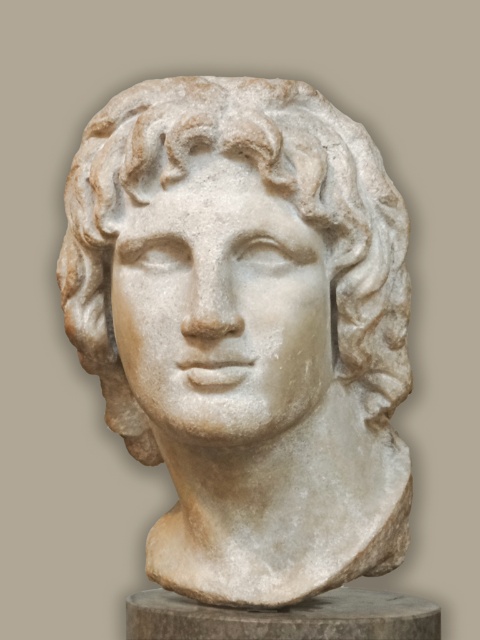
Does white marble head at center come behind white marble bust at center?

No, it is in front of white marble bust at center.

Is white marble head at center above white marble bust at center?

Yes.

Is point (197, 150) behind point (300, 604)?

No, (197, 150) is in front of (300, 604).

Locate an element on the screen. white marble head at center is located at coordinates (266, 188).